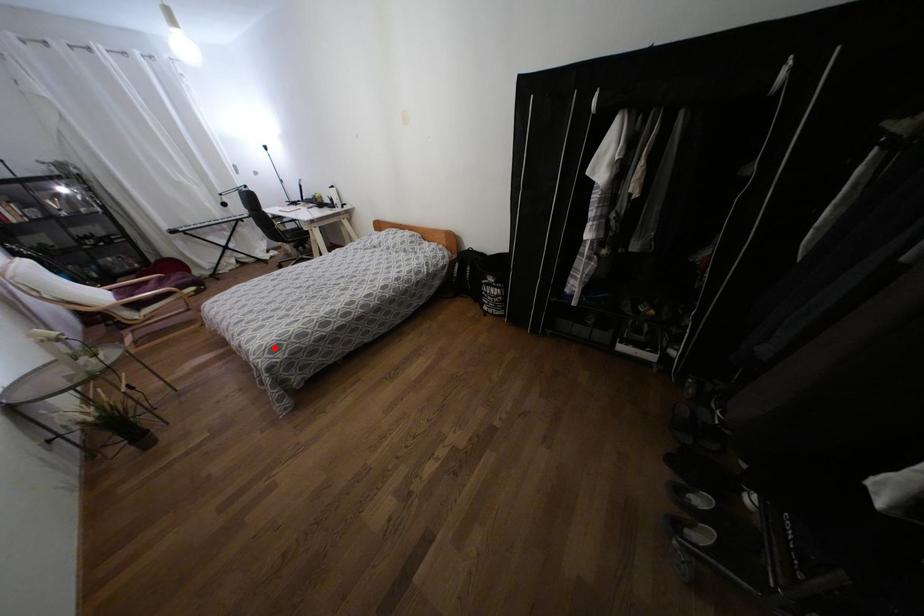
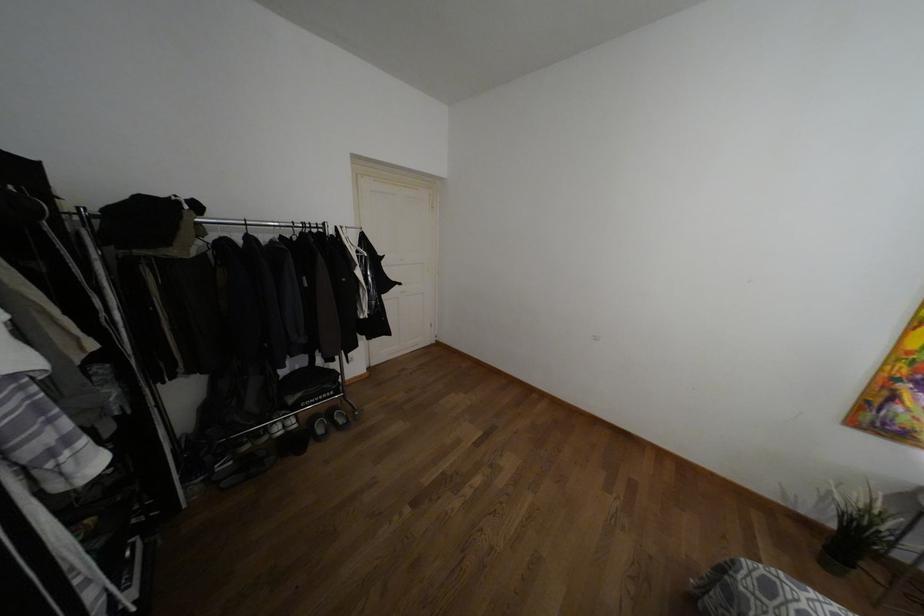
Question: I am providing you with two images of the same scene from different viewpoints. In image1, a red point is highlighted. Considering the same 3D point in image2, which of the following is correct?

Choices:
 (A) It is closer
 (B) It is farther

Answer: (B)